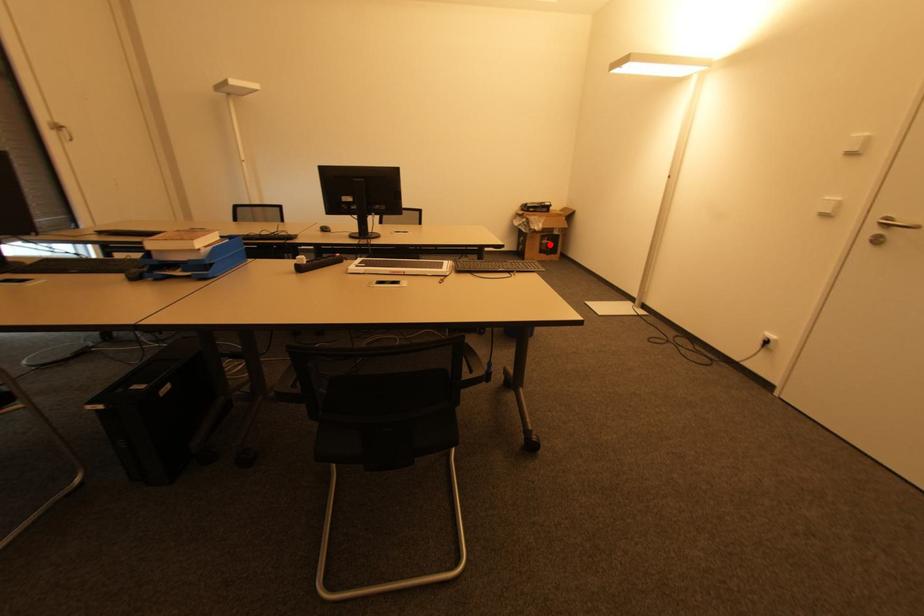
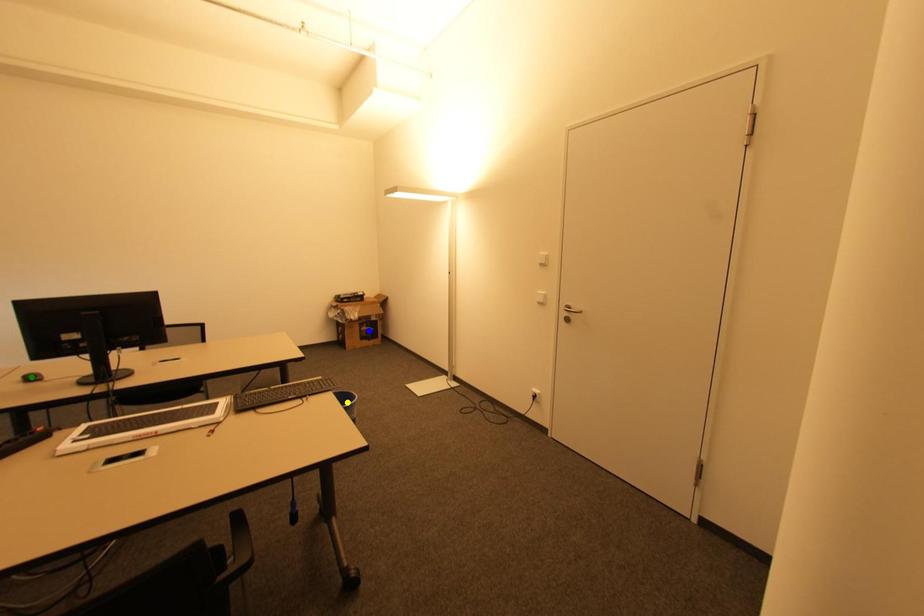
Question: I am providing you with two images of the same scene from different viewpoints. A red point is marked on the first image. You are given multiple points on the second image. Which point in image 2 represents the same 3d spot as the red point in image 1?

Choices:
 (A) yellow point
 (B) blue point
 (C) green point

Answer: (B)